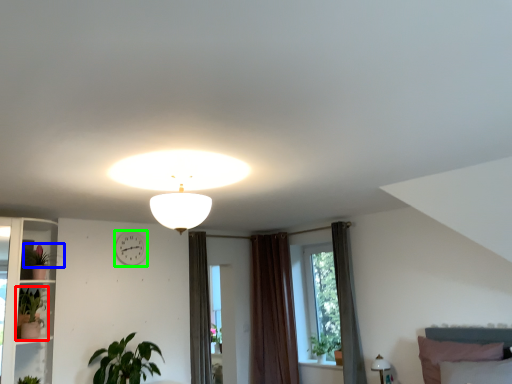
Question: Considering the real-world distances, which object is farthest from houseplant (highlighted by a red box)? plant (highlighted by a blue box) or clock (highlighted by a green box)?

Choices:
 (A) plant
 (B) clock

Answer: (B)